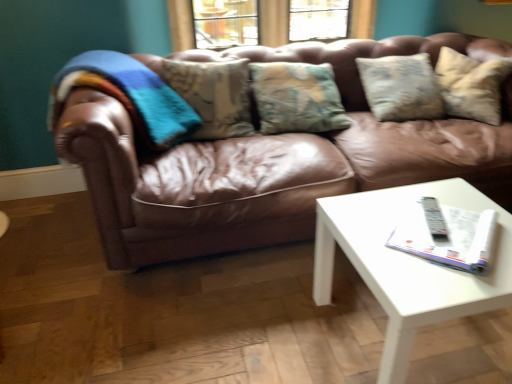
Locate an element on the screen. free spot to the left of white glossy magazine at center right is located at coordinates (367, 232).